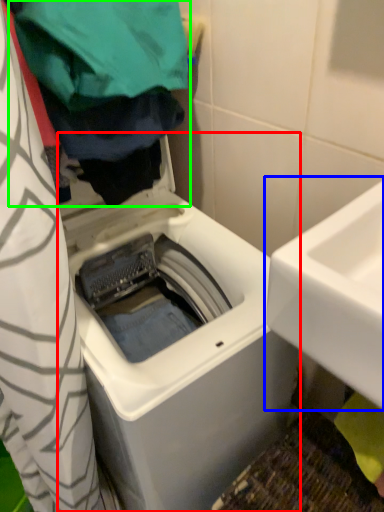
Question: Estimate the real-world distances between objects in this image. Which object is farther from washing machine (highlighted by a red box), sink (highlighted by a blue box) or clothing (highlighted by a green box)?

Choices:
 (A) sink
 (B) clothing

Answer: (B)